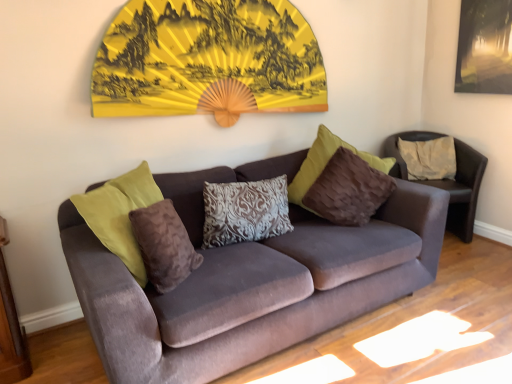
In order to click on free space on the front side of velvet brown armchair at center in this screenshot , I will do `click(473, 266)`.